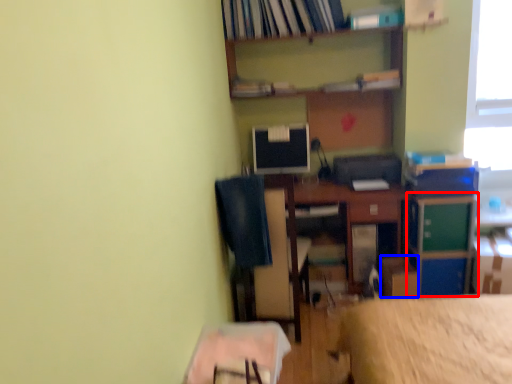
Question: Which object appears closest to the camera in this image, file cabinet (highlighted by a red box) or cardboard box (highlighted by a blue box)?

Choices:
 (A) file cabinet
 (B) cardboard box

Answer: (A)